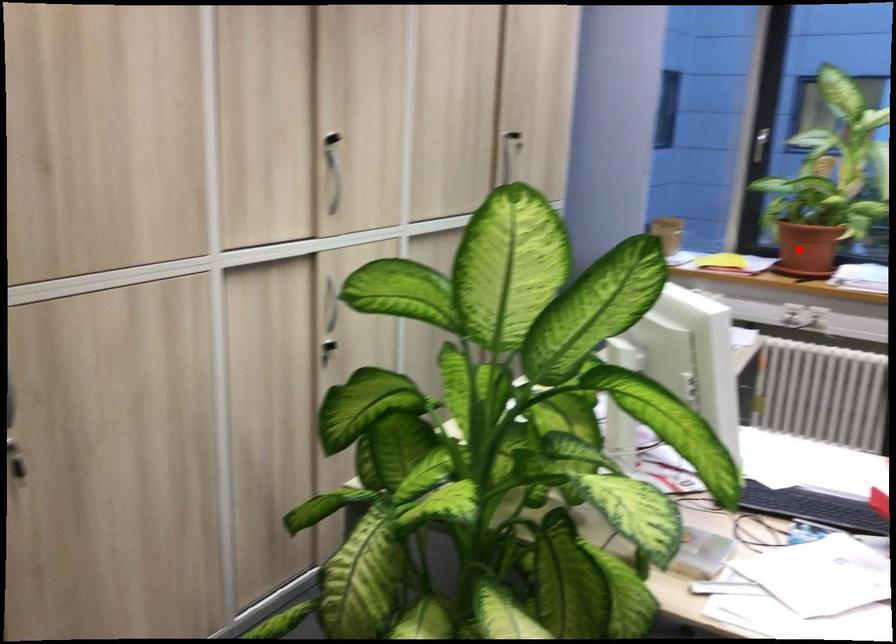
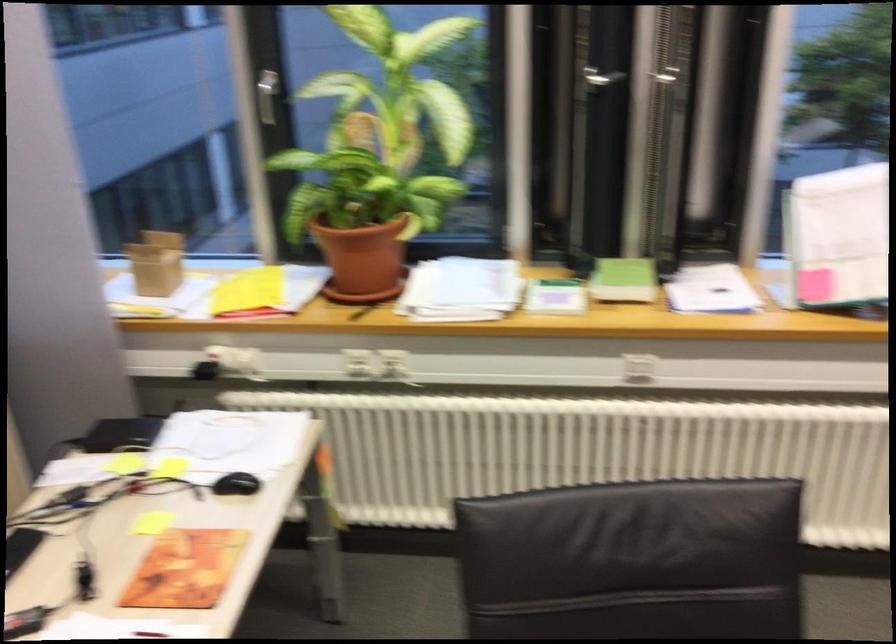
Question: I am providing you with two images of the same scene from different viewpoints. In image1, a red point is highlighted. Considering the same 3D point in image2, which of the following is correct?

Choices:
 (A) It is closer
 (B) It is farther

Answer: (A)